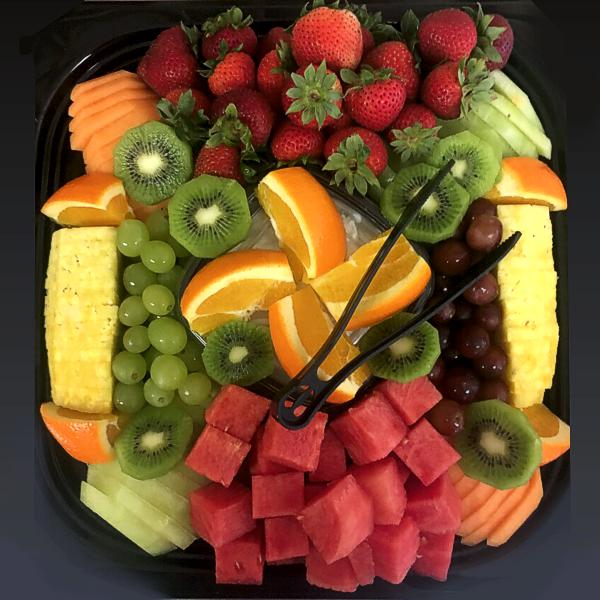
The width and height of the screenshot is (600, 600). I want to click on platter, so click(172, 563), click(474, 553), click(132, 46).